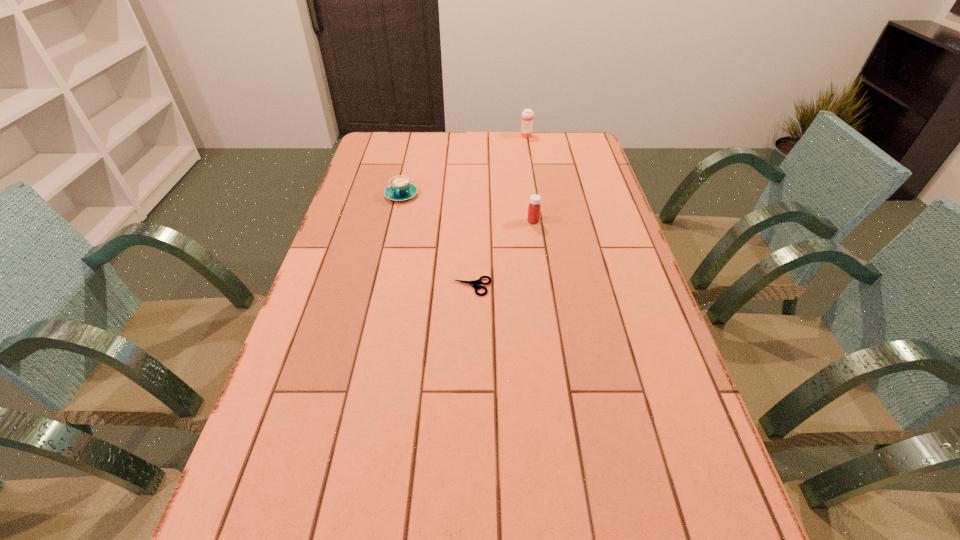
Find the location of a particular element. The image size is (960, 540). free space between the nearest object and the taller medicine is located at coordinates tap(499, 212).

Identify the location of vacant point located between the farthest object and the shortest object. (499, 212).

Where is `unoccupied area between the second nearest object and the taller medicine`? Image resolution: width=960 pixels, height=540 pixels. unoccupied area between the second nearest object and the taller medicine is located at coordinates (530, 179).

The image size is (960, 540). What are the coordinates of `vacant area between the third tallest object and the shears` in the screenshot? It's located at (437, 241).

Identify the location of vacant point located between the leftmost object and the farthest object. This screenshot has height=540, width=960. (464, 165).

Find the location of a particular element. The image size is (960, 540). blank region between the second shortest object and the farthest object is located at coordinates (464, 165).

I want to click on free space between the second farthest object and the shorter medicine, so click(x=468, y=208).

Identify the location of free space between the taller medicine and the leftmost object. The image size is (960, 540). [x=464, y=165].

The width and height of the screenshot is (960, 540). What are the coordinates of `the third closest object to the nearer medicine` in the screenshot? It's located at (527, 115).

You are a GUI agent. You are given a task and a screenshot of the screen. Output one action in this format:
    pyautogui.click(x=<x>, y=<y>)
    Task: Click on the object that is the second closest one to the second object from left to right
    The height and width of the screenshot is (540, 960).
    Given the screenshot: What is the action you would take?
    pyautogui.click(x=400, y=189)